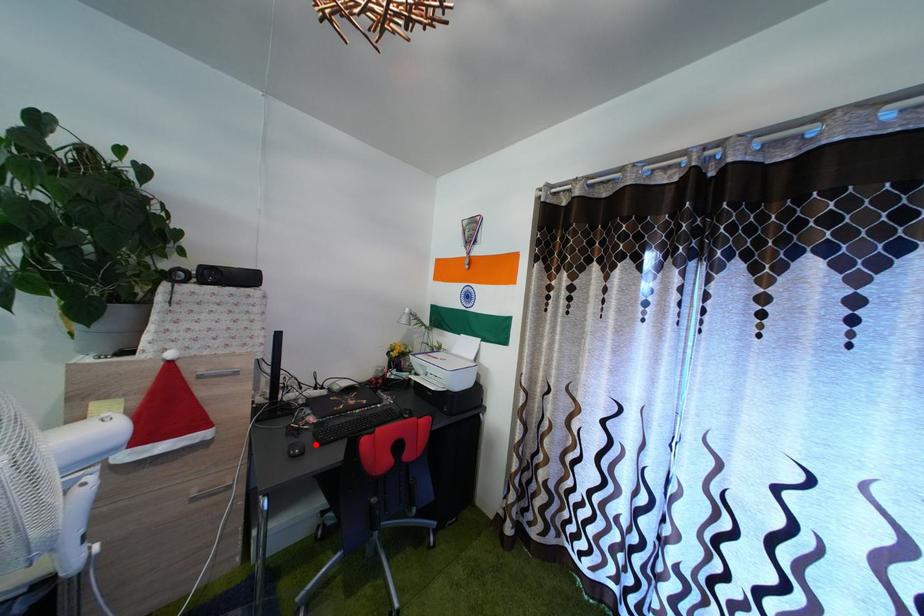
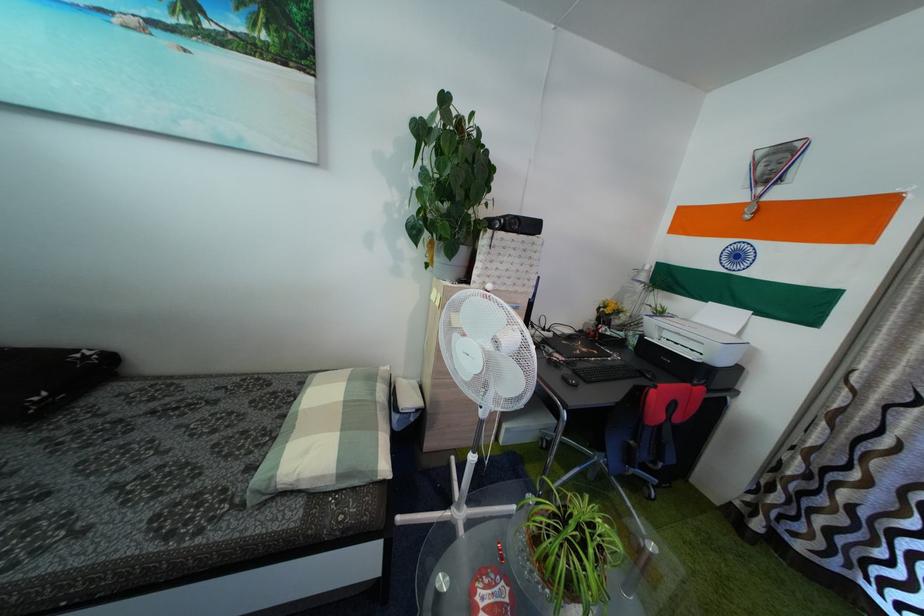
In the second image, find the point that corresponds to the highlighted location in the first image.

(575, 379)